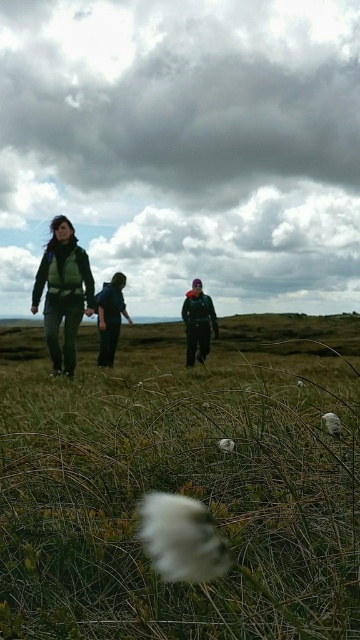
You are a photographer positioned at the center of the field, aiming to capture a photo that includes both the white fluffy cotton at center and the matte green vest at left. Given that your camera has a maximum focus range of 7 meters, will you be able to capture both objects in focus simultaneously?

The white fluffy cotton at center and the matte green vest at left are 7.26 meters apart from each other. Since the distance between them exceeds the camera focus range of 7 meters, you cannot capture both in focus at the same time.

You are a hiker who wants to take a photo of the white fluffy cotton at center and the matte green vest at left. Which object should you focus on first if you want to capture both in the same frame without moving your camera?

The white fluffy cotton at center has a lesser height compared to matte green vest at left, so you should focus on the matte green vest at left first since it is closer to the camera, allowing both objects to be in focus within the same frame.